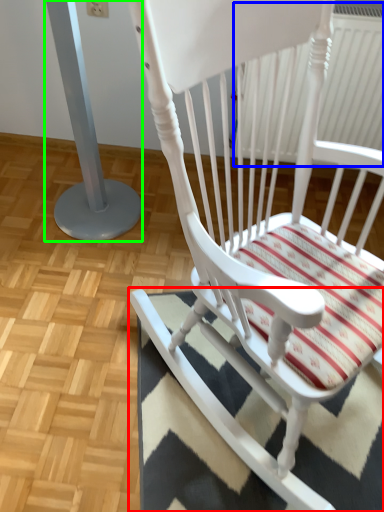
Question: Which is farther away from doormat (highlighted by a red box)? radiator (highlighted by a blue box) or pillar (highlighted by a green box)?

Choices:
 (A) radiator
 (B) pillar

Answer: (A)